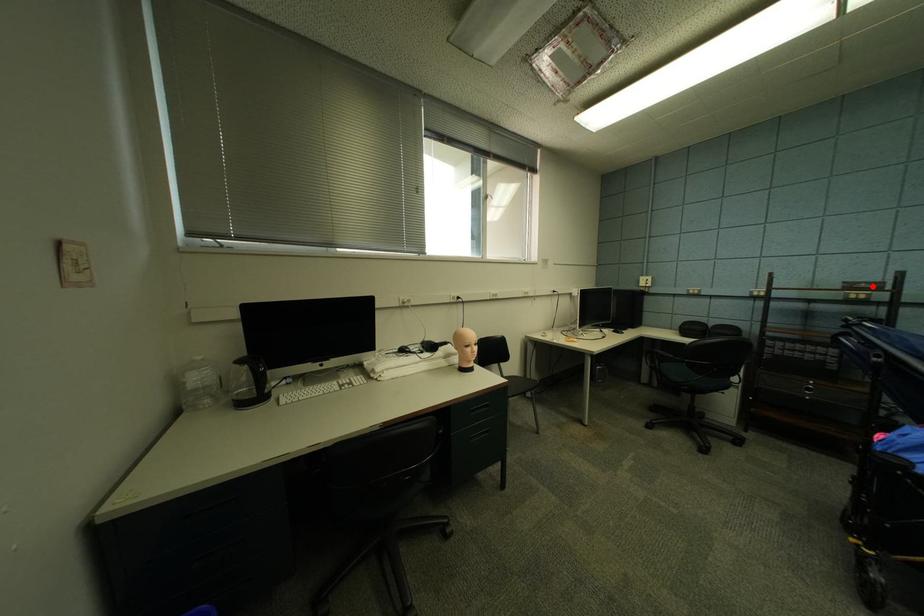
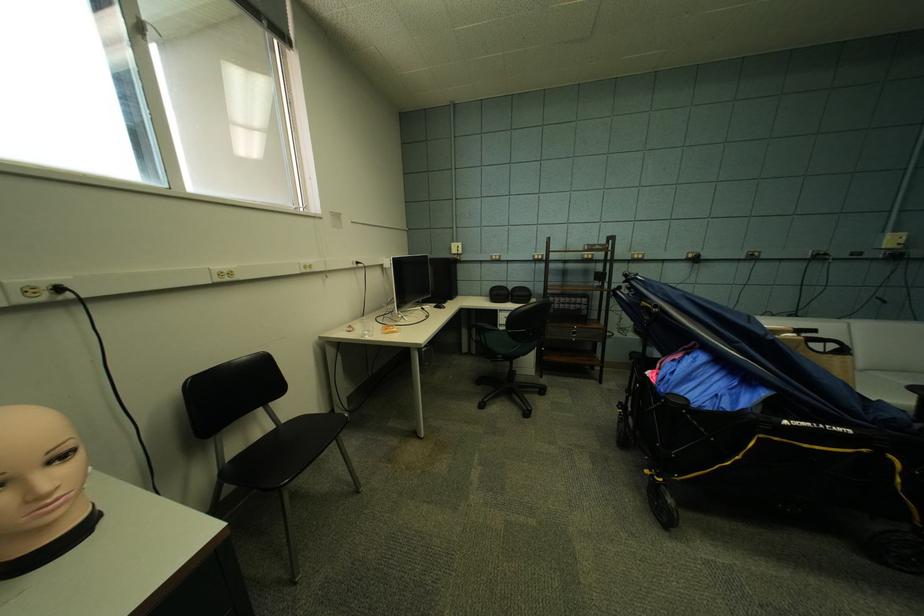
Question: I am providing you with two images of the same scene from different viewpoints. Given a red point in image1, look at the same physical point in image2. Is it:

Choices:
 (A) Closer to the viewpoint
 (B) Farther from the viewpoint

Answer: (A)